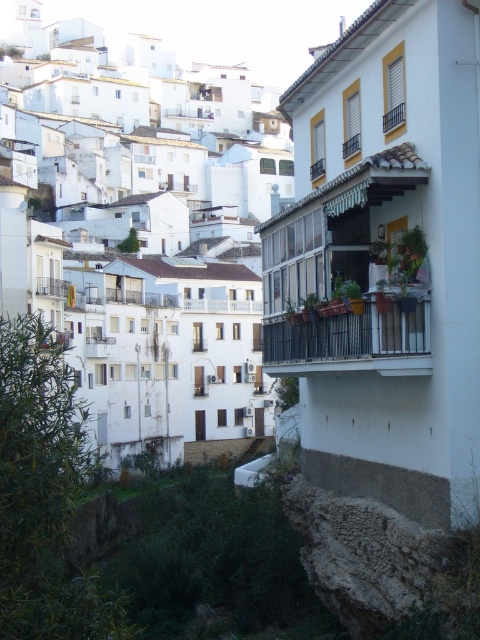
Question: Is black metal balcony at center smaller than white wooden balcony at upper center?

Choices:
 (A) no
 (B) yes

Answer: (A)

Question: Among these objects, which one is farthest from the camera?

Choices:
 (A) white matte building at upper center
 (B) black metal balcony at center
 (C) matte white balcony at center

Answer: (C)

Question: Which point is farther from the camera taking this photo?

Choices:
 (A) (240, 305)
 (B) (175, 145)
 (C) (402, 106)
 (D) (48, 280)

Answer: (B)

Question: Which object is positioned farthest from the white matte building at upper center?

Choices:
 (A) white wooden balcony at upper center
 (B) black metal balcony at center
 (C) matte white balcony at center

Answer: (A)

Question: Considering the relative positions of black metal balcony at center and white wooden balcony at center in the image provided, where is black metal balcony at center located with respect to white wooden balcony at center?

Choices:
 (A) below
 (B) above

Answer: (A)

Question: Is white wooden balcony at center bigger than matte white balcony at center?

Choices:
 (A) yes
 (B) no

Answer: (A)